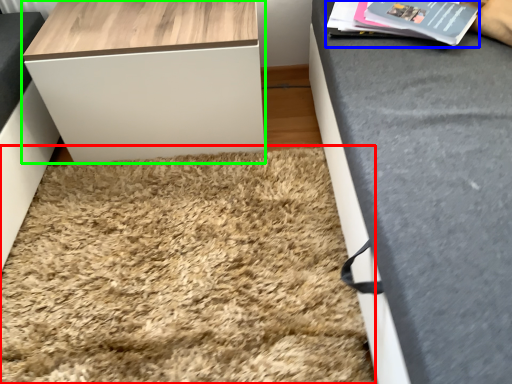
Question: Based on their relative distances, which object is farther from mat (highlighted by a red box)? Choose from magazine (highlighted by a blue box) and table (highlighted by a green box).

Choices:
 (A) magazine
 (B) table

Answer: (A)